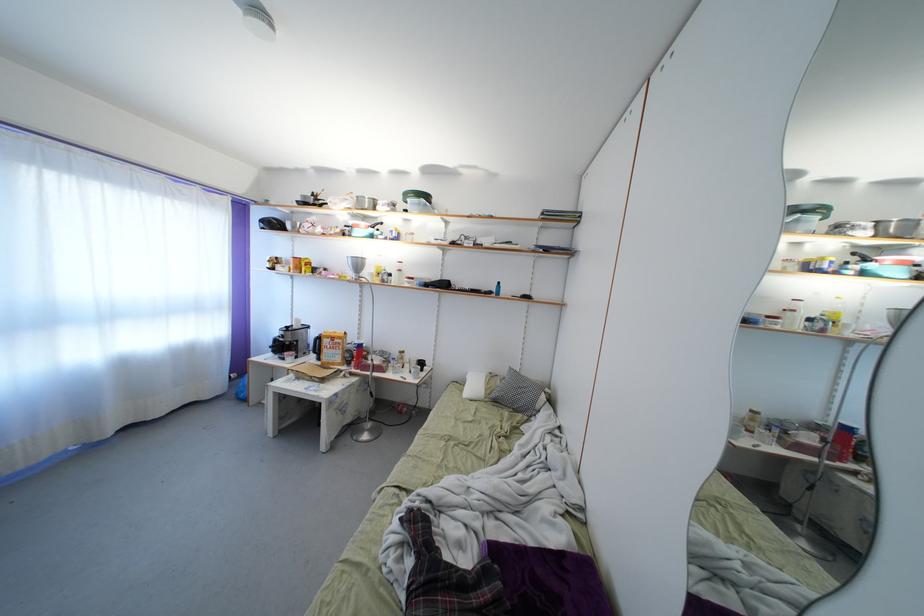
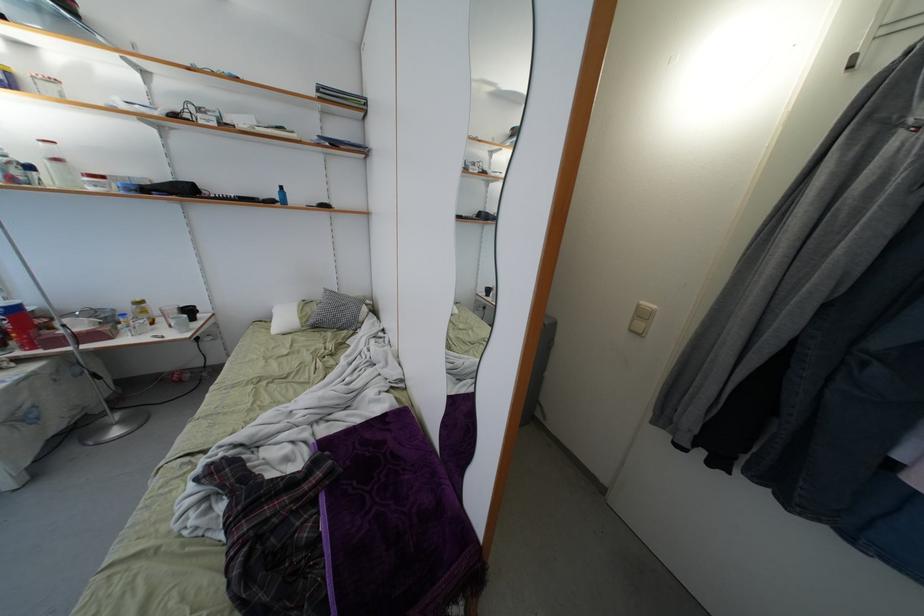
Locate, in the second image, the point that corresponds to point (428, 370) in the first image.

(195, 315)